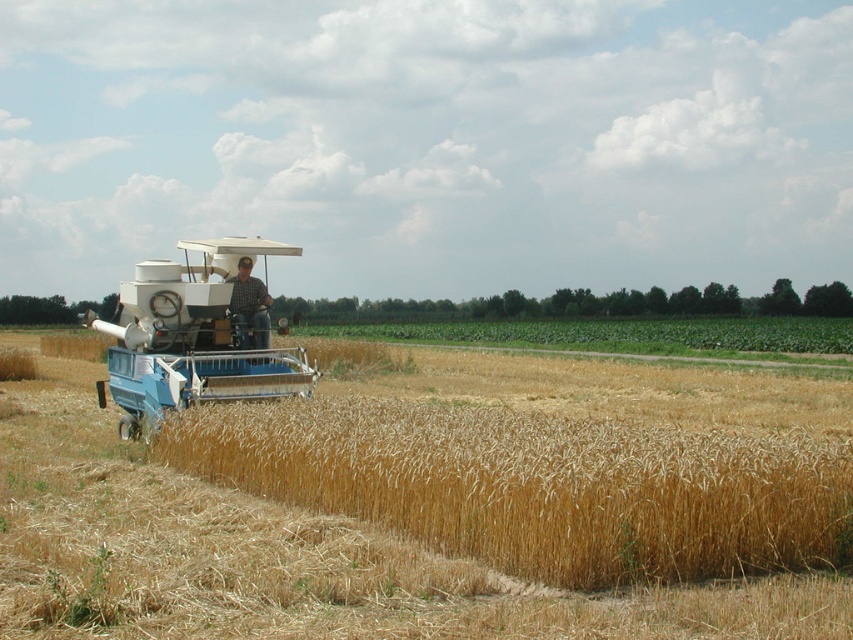
Question: Estimate the real-world distances between objects in this image. Which object is farther from the blue metallic combine at center?

Choices:
 (A) golden dry wheat at center
 (B) plaid shirt at center

Answer: (A)

Question: Among these objects, which one is nearest to the camera?

Choices:
 (A) plaid shirt at center
 (B) blue metallic combine at center
 (C) golden dry wheat at center

Answer: (C)

Question: From the image, what is the correct spatial relationship of golden dry wheat at center in relation to plaid shirt at center?

Choices:
 (A) right
 (B) left

Answer: (A)

Question: Which point is farther from the camera taking this photo?

Choices:
 (A) (154, 330)
 (B) (86, 547)
 (C) (231, 276)

Answer: (C)

Question: Can you confirm if golden dry wheat at center is bigger than plaid shirt at center?

Choices:
 (A) no
 (B) yes

Answer: (B)

Question: Is blue metallic combine at center thinner than plaid shirt at center?

Choices:
 (A) no
 (B) yes

Answer: (A)